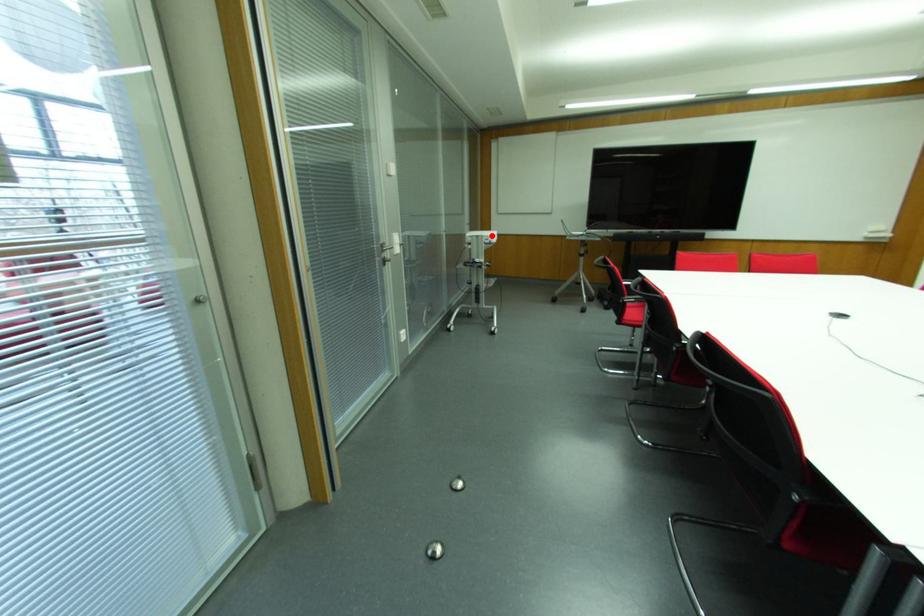
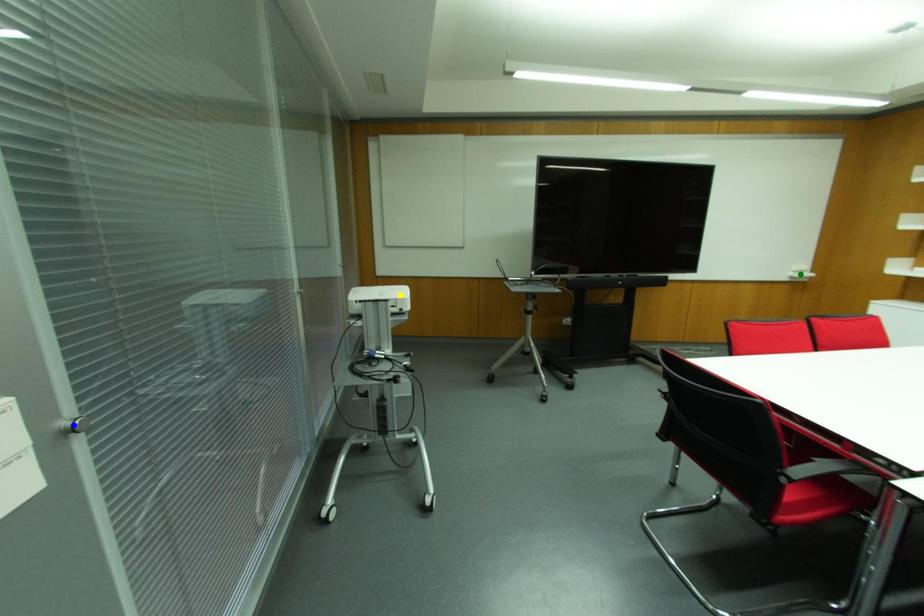
Question: I am providing you with two images of the same scene from different viewpoints. A red point is marked on the first image. You are given multiple points on the second image. Which point in image 2 is actually the same real-world point as the red point in image 1?

Choices:
 (A) blue point
 (B) green point
 (C) yellow point

Answer: (C)